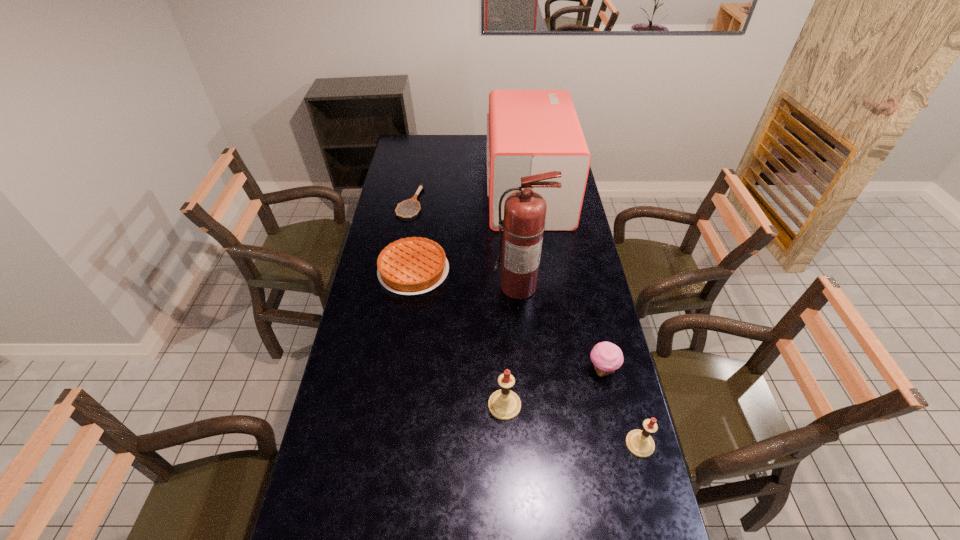
You are a GUI agent. You are given a task and a screenshot of the screen. Output one action in this format:
    pyautogui.click(x=<x>, y=<y>)
    Task: Click on the vacant area that satisfies the following two spatial constraints: 1. on the front side of the pie; 2. on the left side of the fifth tallest object
    The image size is (960, 540).
    Given the screenshot: What is the action you would take?
    pyautogui.click(x=399, y=369)

What are the coordinates of `free location that satisfies the following two spatial constraints: 1. on the surface of the cupcake where the text is embossed; 2. on the right side of the box` in the screenshot? It's located at [551, 369].

The image size is (960, 540). I want to click on vacant space that satisfies the following two spatial constraints: 1. on the front-facing side of the tallest object; 2. on the right side of the third nearest object, so pyautogui.click(x=526, y=369).

Identify the location of vacant area in the image that satisfies the following two spatial constraints: 1. on the front-facing side of the tallest object; 2. on the right side of the cupcake. (526, 369).

Where is `free space that satisfies the following two spatial constraints: 1. on the surface of the sixth shortest object where the text is embossed; 2. on the front-facing side of the fire extinguisher`? free space that satisfies the following two spatial constraints: 1. on the surface of the sixth shortest object where the text is embossed; 2. on the front-facing side of the fire extinguisher is located at coordinates (540, 287).